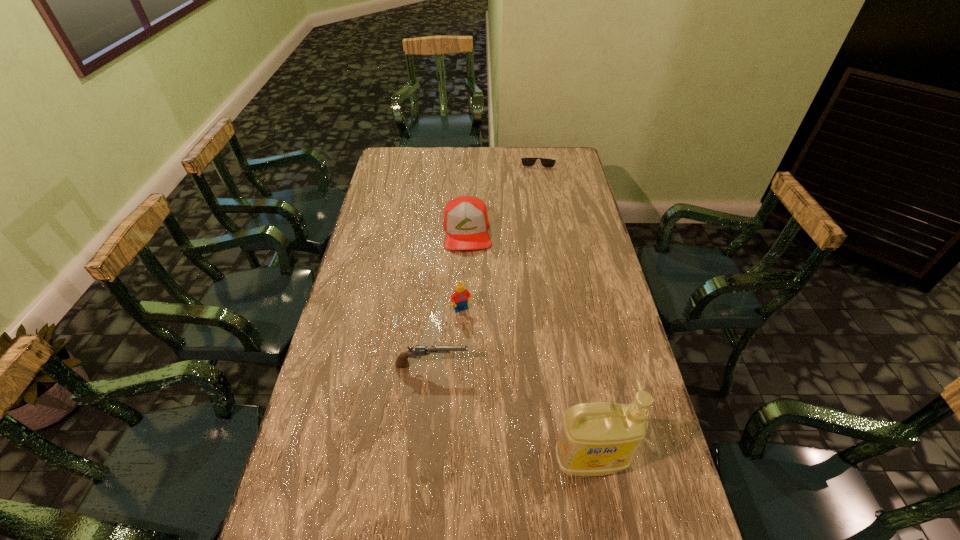
The height and width of the screenshot is (540, 960). I want to click on detergent at the right edge, so click(599, 438).

In order to click on sunglasses that is at the right edge in this screenshot , I will do `click(545, 162)`.

Find the location of a particular element. The width and height of the screenshot is (960, 540). object located at the far right corner is located at coordinates pyautogui.click(x=545, y=162).

This screenshot has height=540, width=960. In order to click on vacant space at the far edge of the desktop in this screenshot , I will do `click(441, 172)`.

This screenshot has height=540, width=960. In the image, there is a desktop. What are the coordinates of `free region at the left edge` in the screenshot? It's located at (374, 206).

You are a GUI agent. You are given a task and a screenshot of the screen. Output one action in this format:
    pyautogui.click(x=<x>, y=<y>)
    Task: Click on the free space at the right edge of the desktop
    This screenshot has height=540, width=960.
    Given the screenshot: What is the action you would take?
    pyautogui.click(x=583, y=296)

The width and height of the screenshot is (960, 540). In order to click on free space at the far left corner of the desktop in this screenshot , I will do `click(415, 157)`.

Image resolution: width=960 pixels, height=540 pixels. Identify the location of blank space at the far right corner. (569, 147).

Locate an element on the screen. This screenshot has height=540, width=960. vacant space at the near right corner of the desktop is located at coordinates (618, 537).

The width and height of the screenshot is (960, 540). Identify the location of free space between the shortest object and the fourth farthest object. (485, 262).